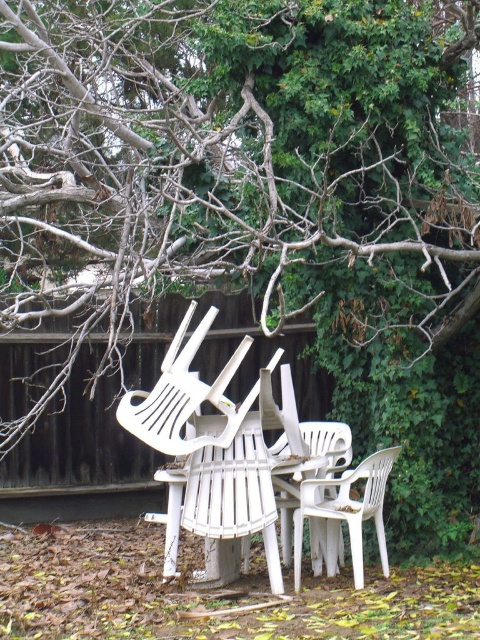
Which is in front, point (38, 1) or point (323, 540)?

Point (323, 540) is in front.

Is brown bark tree at center to the left of white plastic chair at center from the viewer's perspective?

Yes, brown bark tree at center is to the left of white plastic chair at center.

The width and height of the screenshot is (480, 640). I want to click on brown bark tree at center, so pos(219,156).

Who is more forward, (295, 563) or (324, 452)?

Point (295, 563)

Between white plastic chair at lower right and white plastic chair at center, which one has more height?

white plastic chair at center

Who is more distant from viewer, (299, 563) or (282, 515)?

Point (282, 515)

Where is `white plastic chair at lower right`? white plastic chair at lower right is located at coordinates (346, 513).

Does brown bark tree at center come in front of white plastic chair at lower right?

That is True.

Between point (312, 125) and point (384, 531), which one is positioned in front?

Positioned in front is point (312, 125).

Who is more distant from viewer, (123, 172) or (376, 522)?

The point (123, 172) is more distant.

Where is `brown bark tree at center`? brown bark tree at center is located at coordinates (219, 156).